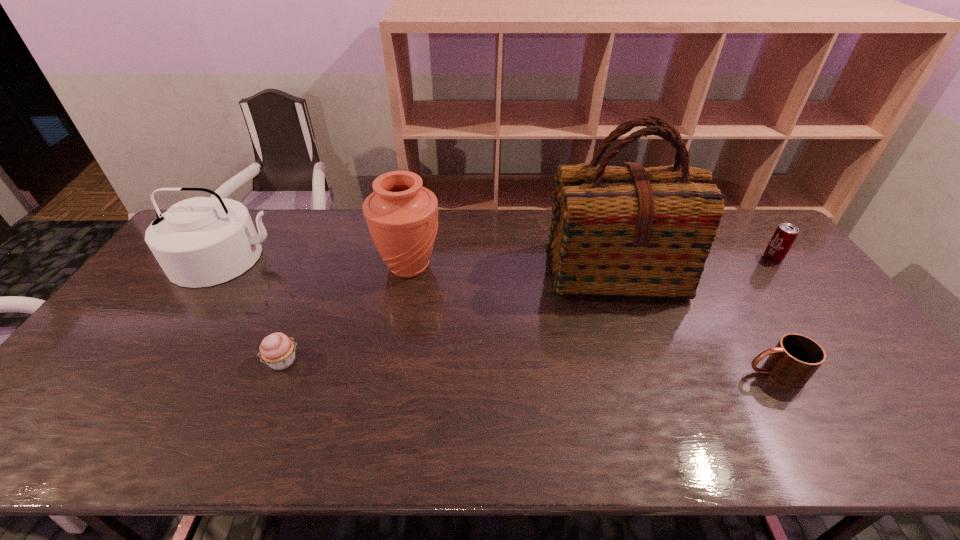
Find the location of a particular element. free space located on the left of the vase is located at coordinates (266, 266).

The height and width of the screenshot is (540, 960). I want to click on free space located 0.140m on the spout of the kettle, so click(x=183, y=323).

I want to click on vacant position located on the left of the beer can, so click(x=714, y=258).

Find the location of a particular element. This screenshot has height=540, width=960. vacant space located 0.140m on the back of the cupcake is located at coordinates (304, 308).

I want to click on free space located 0.250m on the side of the fifth object from left to right with the handle, so click(646, 373).

Find the location of a particular element. The image size is (960, 540). free space located on the side of the fifth object from left to right with the handle is located at coordinates (646, 373).

Locate an element on the screen. This screenshot has width=960, height=540. blank space located 0.230m on the side of the fifth object from left to right with the handle is located at coordinates (654, 373).

Find the location of `shopping bag at the far edge`. shopping bag at the far edge is located at coordinates (626, 231).

Where is `vase at the far edge`? vase at the far edge is located at coordinates (402, 216).

This screenshot has height=540, width=960. I want to click on kettle that is positioned at the far edge, so click(x=199, y=242).